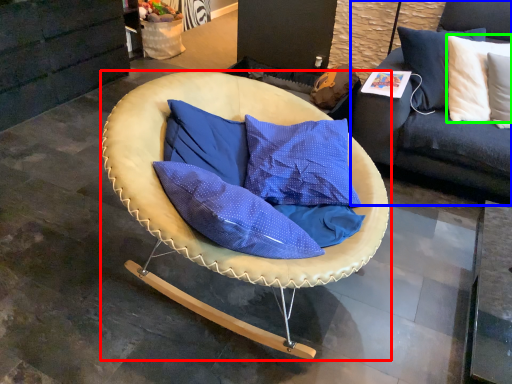
Question: Which object is the farthest from chair (highlighted by a red box)? Choose among these: studio couch (highlighted by a blue box) or pillow (highlighted by a green box).

Choices:
 (A) studio couch
 (B) pillow

Answer: (B)